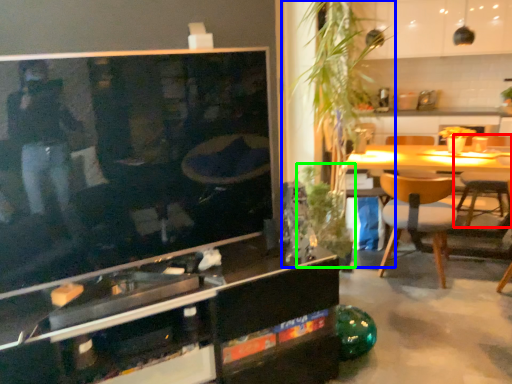
Question: Which is nearer to the chair (highlighted by a red box)? plant (highlighted by a blue box) or plant (highlighted by a green box).

Choices:
 (A) plant
 (B) plant

Answer: (B)